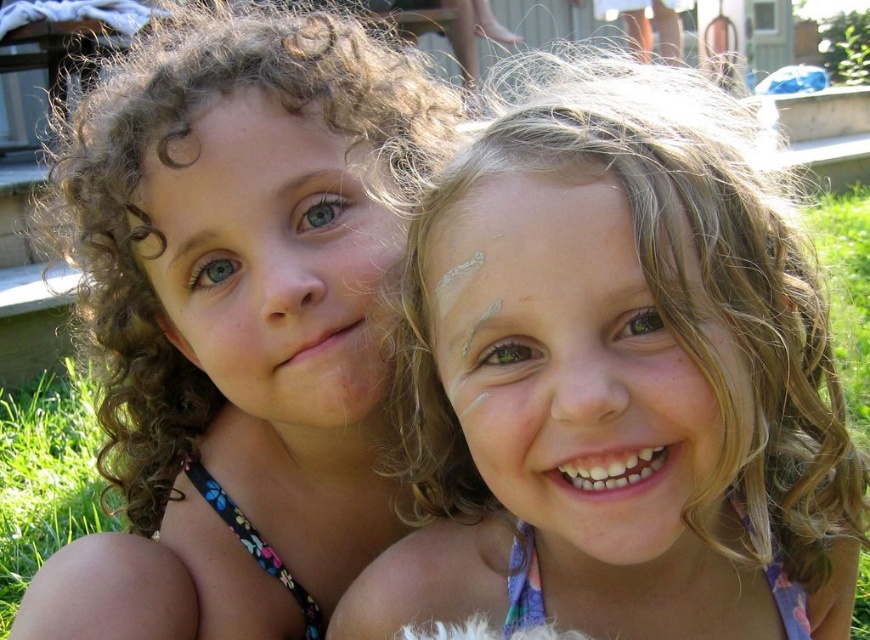
You are a photographer taking a picture of the two children. You notice that the blonde curly hair at upper right and the curly hair at left are at different distances. Which child should you focus on to ensure the closest subject is sharp?

You should focus on the blonde curly hair at upper right because it is closer to the viewer than the curly hair at left, making it the closest subject.

You are a photographer trying to capture both children in a balanced composition. Given that the blonde curly hair at upper right is larger than the curly hair at left, which child should you position closer to the center of the frame to achieve visual balance?

To achieve visual balance, you should position the curly hair at left closer to the center of the frame since the blonde curly hair at upper right is larger and might dominate the composition otherwise.

You are a photographer trying to capture a group shot of the two children. You need to arrange them so that the blonde curly hair at upper right is positioned to the right of the curly hair at left. Based on the current arrangement, is this already the case?

Yes, the blonde curly hair at upper right is already positioned to the right of the curly hair at left, so no adjustment is needed.